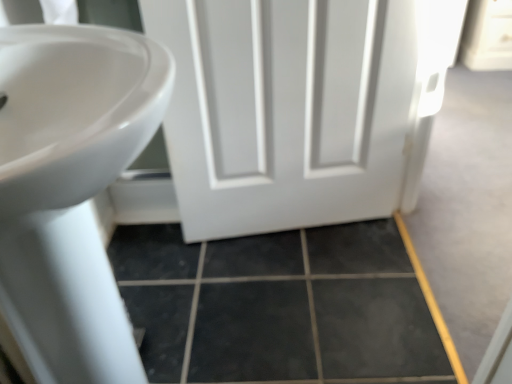
Question: Considering the positions of point [x=180, y=266] and point [x=150, y=82], is point [x=180, y=266] closer or farther from the camera than point [x=150, y=82]?

Choices:
 (A) farther
 (B) closer

Answer: (A)

Question: Considering their positions, is dark gray tile at lower center located in front of or behind white glossy sink at left?

Choices:
 (A) behind
 (B) front

Answer: (A)

Question: Which object is positioned farthest from the dark gray tile at lower center?

Choices:
 (A) white glossy sink at left
 (B) white matte door at center

Answer: (A)

Question: Which object is the closest to the dark gray tile at lower center?

Choices:
 (A) white matte door at center
 (B) white glossy sink at left

Answer: (A)